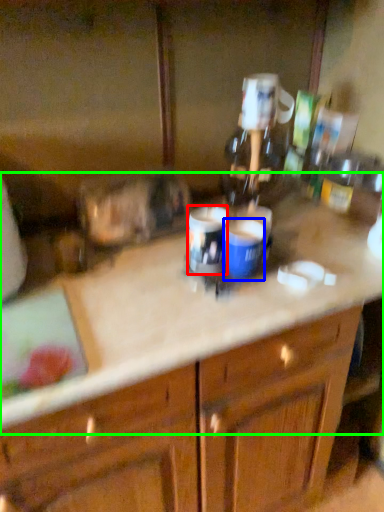
Question: Considering the real-world distances, which object is farthest from beverage (highlighted by a red box)? beverage (highlighted by a blue box) or counter top (highlighted by a green box)?

Choices:
 (A) beverage
 (B) counter top

Answer: (B)